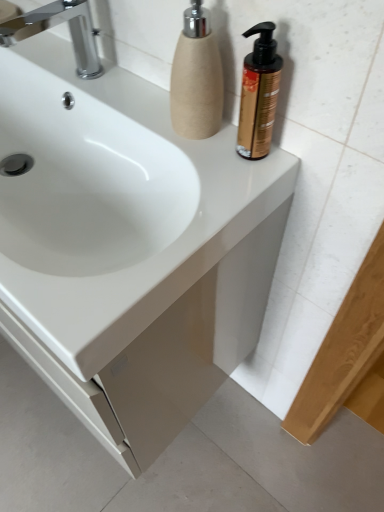
The image size is (384, 512). I want to click on vacant space in front of gold metallic pump bottle at upper right, the first soap dispenser in the right-to-left sequence, so click(222, 203).